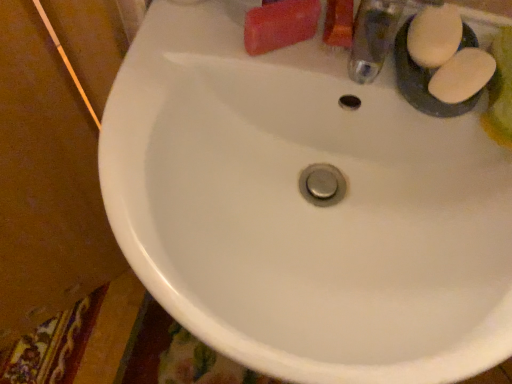
Question: Is white matte soap at upper right, which appears as the 2th soap when viewed from the right, at the left side of white matte soap at upper right, which appears as the third soap when viewed from the left?

Choices:
 (A) yes
 (B) no

Answer: (A)

Question: Is white matte soap at upper right, which appears as the 2th soap when viewed from the right, facing away from white matte soap at upper right, which appears as the third soap when viewed from the left?

Choices:
 (A) yes
 (B) no

Answer: (B)

Question: Is the position of white matte soap at upper right, which is the 2th soap in left-to-right order, more distant than that of white matte soap at upper right, which is counted as the first soap, starting from the right?

Choices:
 (A) no
 (B) yes

Answer: (B)

Question: Is white matte soap at upper right, which is the 2th soap in left-to-right order, to the right of white matte soap at upper right, which appears as the third soap when viewed from the left, from the viewer's perspective?

Choices:
 (A) no
 (B) yes

Answer: (A)

Question: From a real-world perspective, does white matte soap at upper right, which appears as the 2th soap when viewed from the right, stand above white matte soap at upper right, which appears as the third soap when viewed from the left?

Choices:
 (A) no
 (B) yes

Answer: (B)

Question: From a real-world perspective, is white matte soap at upper right, which is counted as the first soap, starting from the right, physically located above or below matte pink bar of soap at upper right, which ranks as the first soap in left-to-right order?

Choices:
 (A) above
 (B) below

Answer: (B)

Question: Based on their positions, is white matte soap at upper right, which appears as the third soap when viewed from the left, located to the left or right of matte pink bar of soap at upper right, which ranks as the first soap in left-to-right order?

Choices:
 (A) right
 (B) left

Answer: (A)

Question: Considering the positions of point (462, 57) and point (308, 6), is point (462, 57) closer or farther from the camera than point (308, 6)?

Choices:
 (A) farther
 (B) closer

Answer: (A)

Question: From the image's perspective, is white matte soap at upper right, which appears as the third soap when viewed from the left, above or below matte pink bar of soap at upper right, placed as the third soap when sorted from right to left?

Choices:
 (A) above
 (B) below

Answer: (B)

Question: Is matte pink bar of soap at upper right, which ranks as the first soap in left-to-right order, inside or outside of white matte soap at upper right, which is the 2th soap in left-to-right order?

Choices:
 (A) outside
 (B) inside

Answer: (A)

Question: Is matte pink bar of soap at upper right, which ranks as the first soap in left-to-right order, bigger or smaller than white matte soap at upper right, which appears as the 2th soap when viewed from the right?

Choices:
 (A) small
 (B) big

Answer: (A)

Question: From their relative heights in the image, would you say matte pink bar of soap at upper right, placed as the third soap when sorted from right to left, is taller or shorter than white matte soap at upper right, which appears as the 2th soap when viewed from the right?

Choices:
 (A) short
 (B) tall

Answer: (B)

Question: In terms of width, does matte pink bar of soap at upper right, placed as the third soap when sorted from right to left, look wider or thinner when compared to white matte soap at upper right, which appears as the 2th soap when viewed from the right?

Choices:
 (A) thin
 (B) wide

Answer: (B)

Question: Considering the positions of white matte soap at upper right, which appears as the 2th soap when viewed from the right, and white matte soap at upper right, which is counted as the first soap, starting from the right, in the image, is white matte soap at upper right, which appears as the 2th soap when viewed from the right, taller or shorter than white matte soap at upper right, which is counted as the first soap, starting from the right,?

Choices:
 (A) short
 (B) tall

Answer: (B)

Question: Would you say white matte soap at upper right, which appears as the 2th soap when viewed from the right, is inside or outside white matte soap at upper right, which appears as the third soap when viewed from the left?

Choices:
 (A) outside
 (B) inside

Answer: (A)